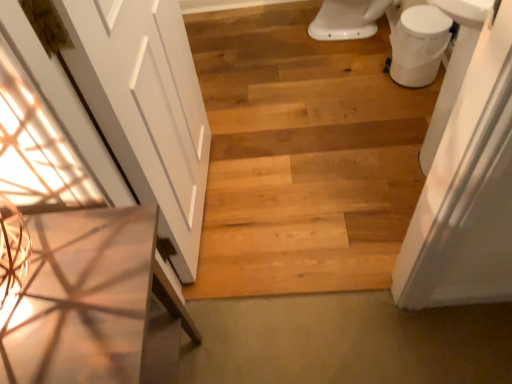
Locate an element on the screen. Image resolution: width=512 pixels, height=384 pixels. free spot to the left of white glossy toilet bowl at upper right is located at coordinates (365, 83).